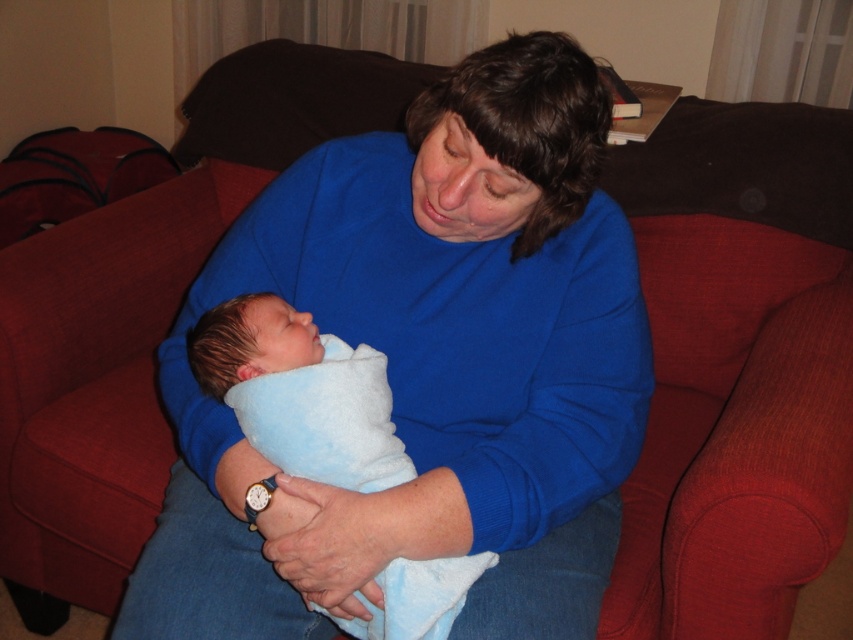
Question: From the image, what is the correct spatial relationship of blue soft sweater at center in relation to blue soft blanket at center?

Choices:
 (A) above
 (B) below

Answer: (A)

Question: Is blue soft sweater at center wider than blue soft blanket at center?

Choices:
 (A) yes
 (B) no

Answer: (A)

Question: Is blue soft sweater at center smaller than blue soft blanket at center?

Choices:
 (A) no
 (B) yes

Answer: (A)